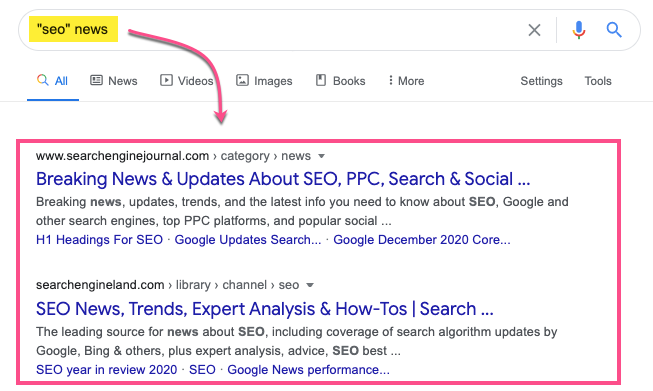
Find the location of a particular element. This screenshot has height=391, width=653. bar settings is located at coordinates (549, 72).